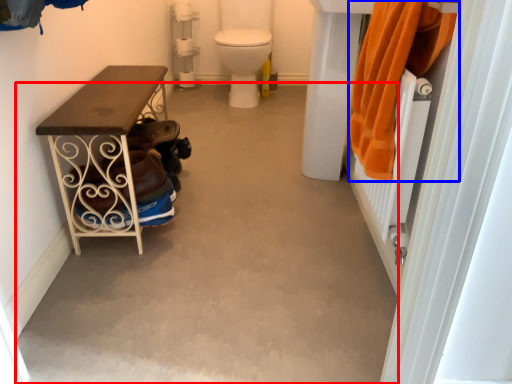
Question: Which of the following is the farthest to the observer, concrete (highlighted by a red box) or clothing (highlighted by a blue box)?

Choices:
 (A) concrete
 (B) clothing

Answer: (A)